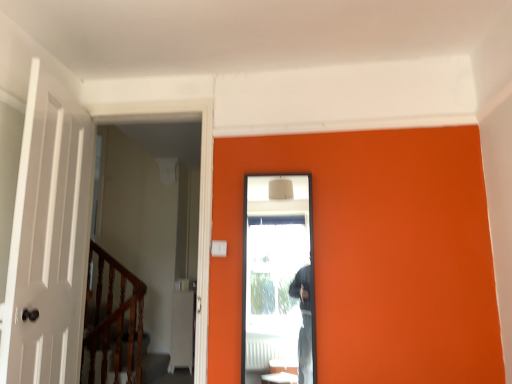
Where is `clear glass screen door at center`? The width and height of the screenshot is (512, 384). clear glass screen door at center is located at coordinates (277, 273).

The image size is (512, 384). What do you see at coordinates (277, 273) in the screenshot?
I see `clear glass screen door at center` at bounding box center [277, 273].

Locate an element on the screen. wooden polished rail at left is located at coordinates 113,318.

Image resolution: width=512 pixels, height=384 pixels. Describe the element at coordinates (113, 318) in the screenshot. I see `wooden polished rail at left` at that location.

The height and width of the screenshot is (384, 512). Find the location of `clear glass screen door at center`. clear glass screen door at center is located at coordinates (277, 273).

Which object is positioned more to the left, clear glass screen door at center or wooden polished rail at left?

wooden polished rail at left is more to the left.

Relative to wooden polished rail at left, is clear glass screen door at center in front or behind?

Visually, clear glass screen door at center is located in front of wooden polished rail at left.

Which is in front, point (243, 300) or point (101, 366)?

Positioned in front is point (243, 300).

From the image's perspective, is clear glass screen door at center located above or below wooden polished rail at left?

Based on their image positions, clear glass screen door at center is located above wooden polished rail at left.

From a real-world perspective, relative to wooden polished rail at left, is clear glass screen door at center vertically above or below?

clear glass screen door at center is situated higher than wooden polished rail at left in the real world.

Considering the relative sizes of clear glass screen door at center and wooden polished rail at left in the image provided, is clear glass screen door at center wider than wooden polished rail at left?

In fact, clear glass screen door at center might be narrower than wooden polished rail at left.

Can you confirm if clear glass screen door at center is taller than wooden polished rail at left?

No.

Based on their sizes in the image, would you say clear glass screen door at center is bigger or smaller than wooden polished rail at left?

clear glass screen door at center is smaller than wooden polished rail at left.

Could wooden polished rail at left be considered to be inside clear glass screen door at center?

No, wooden polished rail at left is not a part of clear glass screen door at center.

Are clear glass screen door at center and wooden polished rail at left located far from each other?

clear glass screen door at center is far away from wooden polished rail at left.

Is clear glass screen door at center oriented towards wooden polished rail at left?

No, clear glass screen door at center does not turn towards wooden polished rail at left.

What's the angular difference between clear glass screen door at center and wooden polished rail at left's facing directions?

The facing directions of clear glass screen door at center and wooden polished rail at left are 88.6 degrees apart.

The height and width of the screenshot is (384, 512). I want to click on screen door in front of the wooden polished rail at left, so click(277, 273).

Visually, is wooden polished rail at left positioned to the left or to the right of clear glass screen door at center?

Based on their positions, wooden polished rail at left is located to the left of clear glass screen door at center.

Is the depth of wooden polished rail at left greater than that of clear glass screen door at center?

Yes, it is behind clear glass screen door at center.

Which is closer to the camera, (x=135, y=278) or (x=251, y=269)?

Point (x=135, y=278) is farther from the camera than point (x=251, y=269).

From the image's perspective, is wooden polished rail at left below clear glass screen door at center?

Yes, from the image's perspective, wooden polished rail at left is below clear glass screen door at center.

From a real-world perspective, between wooden polished rail at left and clear glass screen door at center, who is vertically higher?

From a 3D spatial view, clear glass screen door at center is above.

Looking at their sizes, would you say wooden polished rail at left is wider or thinner than clear glass screen door at center?

In the image, wooden polished rail at left appears to be wider than clear glass screen door at center.

Considering the sizes of objects wooden polished rail at left and clear glass screen door at center in the image provided, who is taller, wooden polished rail at left or clear glass screen door at center?

wooden polished rail at left is taller.

Consider the image. Is wooden polished rail at left smaller than clear glass screen door at center?

No.

Is wooden polished rail at left situated inside clear glass screen door at center or outside?

The correct answer is: outside.

Is wooden polished rail at left in contact with clear glass screen door at center?

No, wooden polished rail at left is not next to clear glass screen door at center.

Is wooden polished rail at left facing away from clear glass screen door at center?

No, wooden polished rail at left's orientation is not away from clear glass screen door at center.

What are the coordinates of `rail that appears below the clear glass screen door at center (from a real-world perspective)` in the screenshot? It's located at (113, 318).

The width and height of the screenshot is (512, 384). I want to click on rail behind the clear glass screen door at center, so click(113, 318).

Locate an element on the screen. The width and height of the screenshot is (512, 384). rail to the left of clear glass screen door at center is located at coordinates (113, 318).